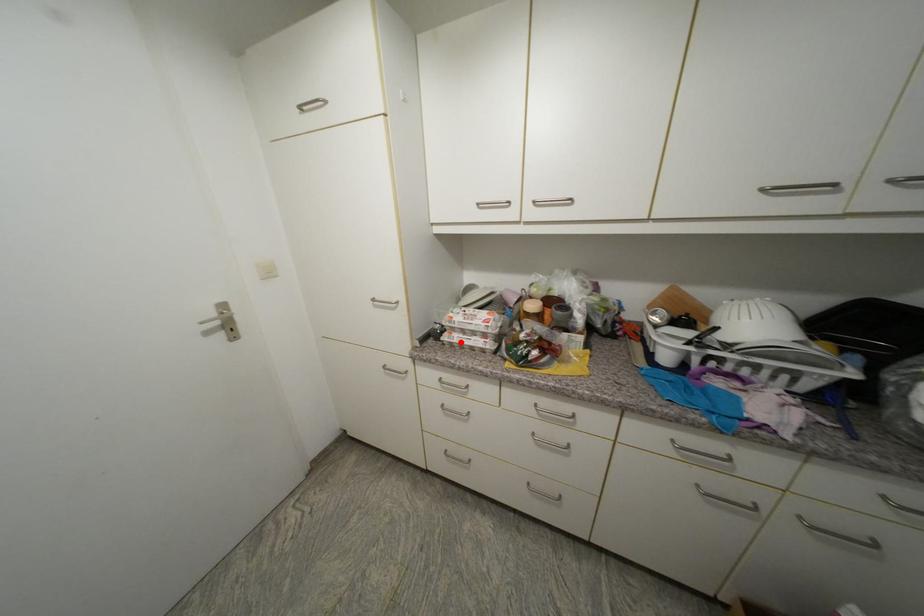
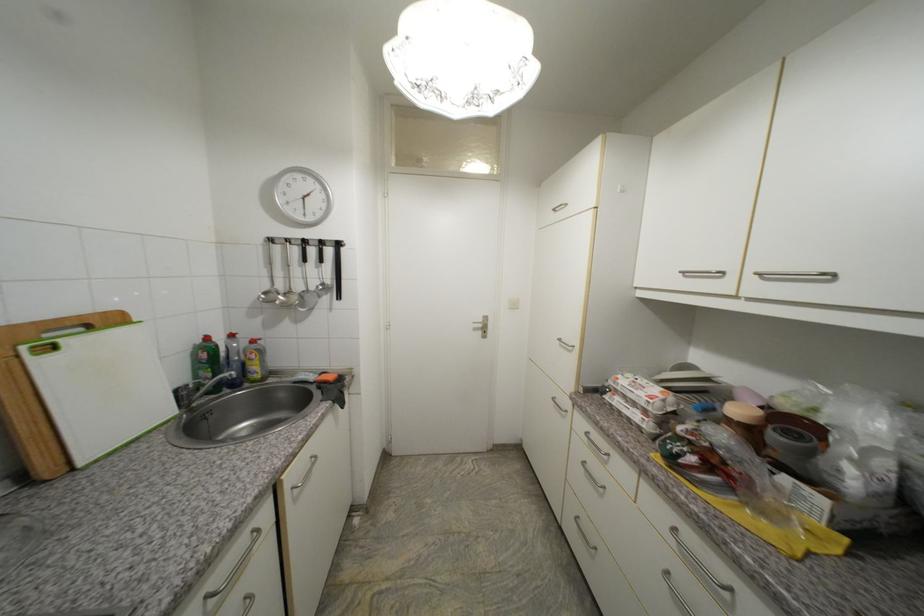
Question: I am providing you with two images of the same scene from different viewpoints. A red point is marked on the first image. Is the red point's position out of view in image 2?

Choices:
 (A) Yes
 (B) No

Answer: (B)